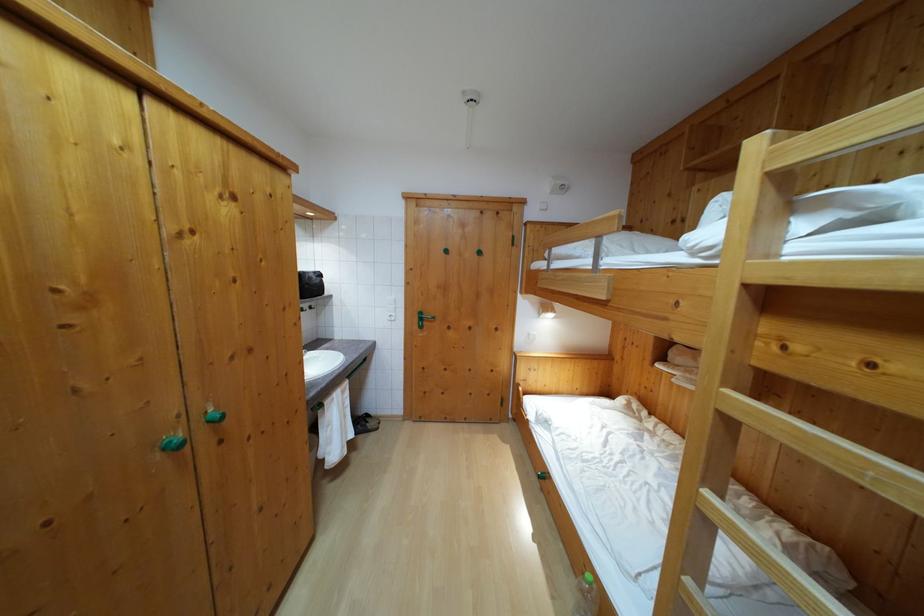
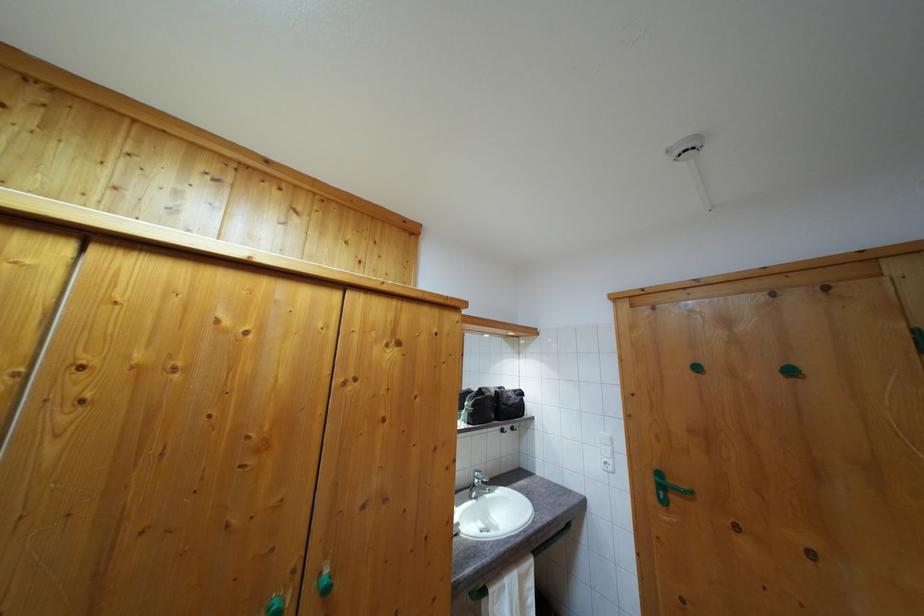
Locate, in the second image, the point that corresponds to (424,326) in the first image.

(664, 493)